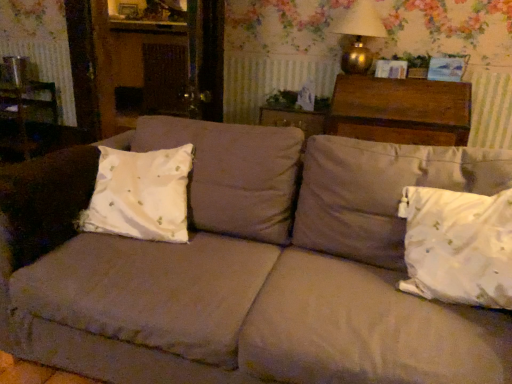
Question: Is gold metallic table lamp at upper right to the left of dark brown wood chest at upper right from the viewer's perspective?

Choices:
 (A) no
 (B) yes

Answer: (B)

Question: Does gold metallic table lamp at upper right have a greater height compared to dark brown wood chest at upper right?

Choices:
 (A) no
 (B) yes

Answer: (A)

Question: Can we say gold metallic table lamp at upper right lies outside dark brown wood chest at upper right?

Choices:
 (A) yes
 (B) no

Answer: (A)

Question: Are gold metallic table lamp at upper right and dark brown wood chest at upper right making contact?

Choices:
 (A) yes
 (B) no

Answer: (B)

Question: From a real-world perspective, is gold metallic table lamp at upper right below dark brown wood chest at upper right?

Choices:
 (A) no
 (B) yes

Answer: (A)

Question: From a real-world perspective, is gold metallic table lamp at upper right on dark brown wood chest at upper right?

Choices:
 (A) no
 (B) yes

Answer: (B)

Question: Considering the relative sizes of wooden picture frame at upper center and white cotton pillow at left, which is the 1th pillow from left to right, in the image provided, is wooden picture frame at upper center shorter than white cotton pillow at left, which is the 1th pillow from left to right,?

Choices:
 (A) no
 (B) yes

Answer: (B)

Question: Is wooden picture frame at upper center not inside white cotton pillow at left, which is the 1th pillow from left to right?

Choices:
 (A) yes
 (B) no

Answer: (A)

Question: Does wooden picture frame at upper center have a larger size compared to white cotton pillow at left, the second pillow positioned from the right?

Choices:
 (A) no
 (B) yes

Answer: (A)

Question: From a real-world perspective, is wooden picture frame at upper center beneath white cotton pillow at left, which is the 1th pillow from left to right?

Choices:
 (A) no
 (B) yes

Answer: (A)

Question: From a real-world perspective, is wooden picture frame at upper center over white cotton pillow at left, the second pillow positioned from the right?

Choices:
 (A) no
 (B) yes

Answer: (B)

Question: Is wooden picture frame at upper center aimed at white cotton pillow at left, the second pillow positioned from the right?

Choices:
 (A) yes
 (B) no

Answer: (B)

Question: From the image's perspective, does white satin pillow at lower right, marked as the 1th pillow in a right-to-left arrangement, appear higher than wooden picture frame at upper center?

Choices:
 (A) no
 (B) yes

Answer: (A)